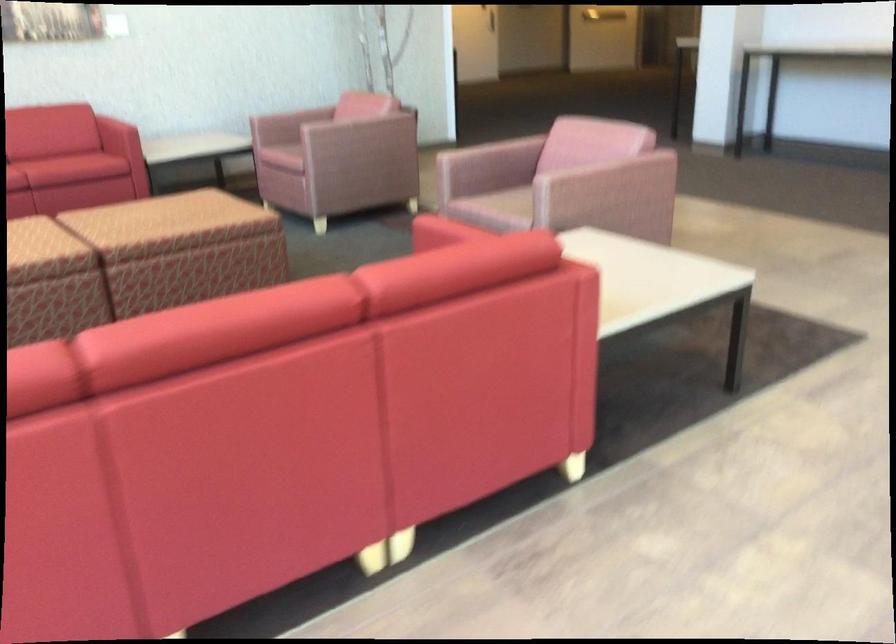
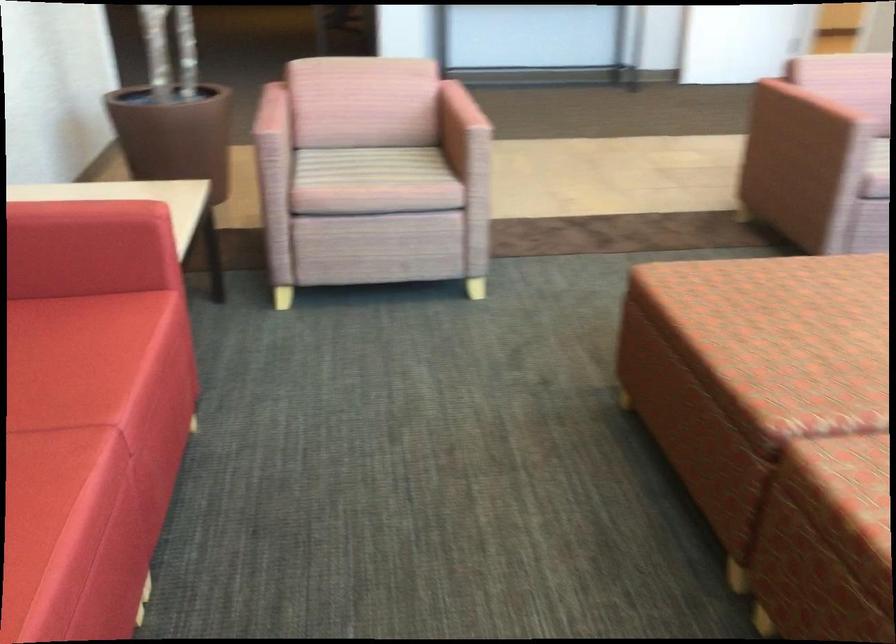
The point at (190,193) is marked in the first image. Where is the corresponding point in the second image?

(805, 304)